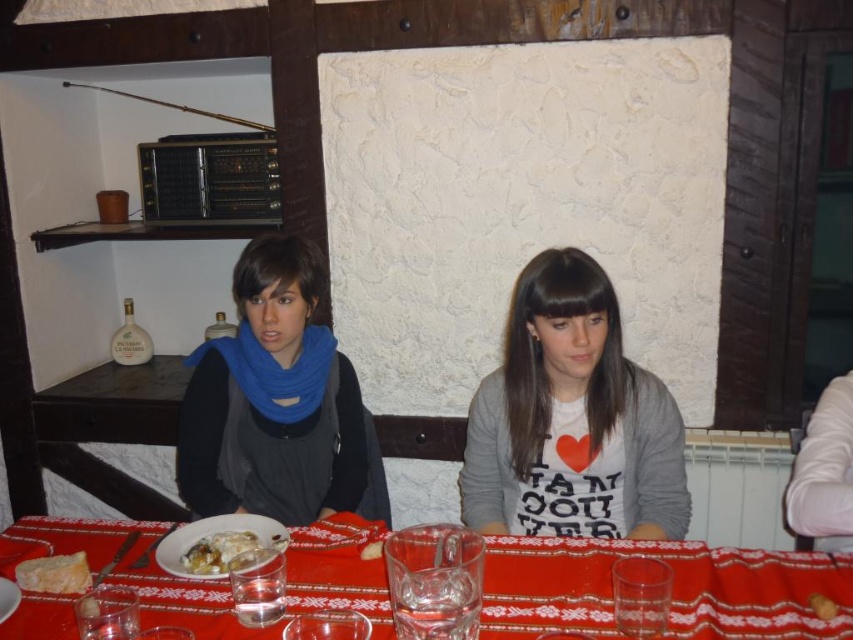
You are a photographer aiming to capture a closeup of the blue scarf at center and white glossy plate at center. Which object should you focus on first if you want to ensure both are in frame without moving the camera?

The blue scarf at center is wider than the white glossy plate at center. To include both in the frame without moving the camera, focus on the blue scarf at center first since it occupies more space, ensuring the plate will also fit within the composition.

You are taking a photo of the table with the two points marked. Which point, point (190,564) or point (245,538), will appear larger in your photo?

Point (190,564) is closer to the camera than point (245,538), so it will appear larger in the photo.